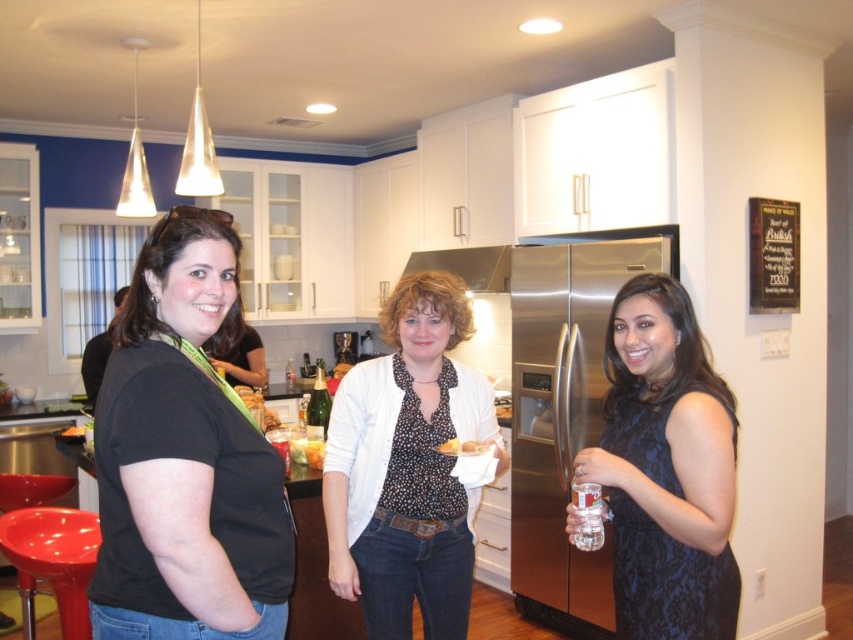
Question: Estimate the real-world distances between objects in this image. Which object is farther from the black matte shirt at left?

Choices:
 (A) green glass bottle at center
 (B) clear glass bottle at right
 (C) white textured sweater at center

Answer: (A)

Question: Is shiny plastic stool at lower left positioned at the back of translucent glass wine at center?

Choices:
 (A) no
 (B) yes

Answer: (B)

Question: Is black matte shirt at left bigger than green glass bottle at center?

Choices:
 (A) no
 (B) yes

Answer: (B)

Question: Which point appears farthest from the camera in this image?

Choices:
 (A) (251, 378)
 (B) (96, 552)
 (C) (637, 600)

Answer: (A)

Question: Which point appears farthest from the camera in this image?

Choices:
 (A) (314, 397)
 (B) (636, 401)
 (C) (251, 356)

Answer: (C)

Question: Can you confirm if matte black shirt at center is positioned below translucent glass wine at center?

Choices:
 (A) yes
 (B) no

Answer: (B)